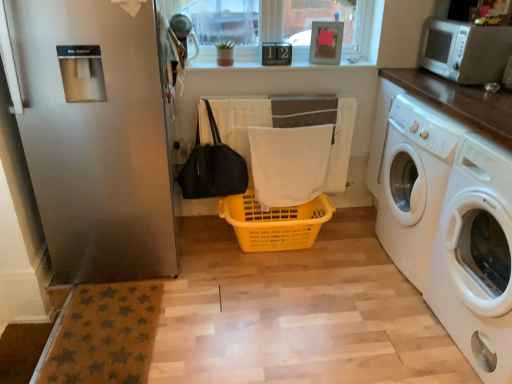
Question: From a real-world perspective, relative to white fabric bath towel at center, is white glossy washing machine at right, the 1th washing machine positioned from the front, vertically above or below?

Choices:
 (A) below
 (B) above

Answer: (B)

Question: Looking at their shapes, would you say white glossy washing machine at right, the 1th washing machine positioned from the front, is wider or thinner than white fabric bath towel at center?

Choices:
 (A) thin
 (B) wide

Answer: (B)

Question: Considering the real-world distances, which object is closest to the white glossy washing machine at right, which is the second washing machine in front-to-back order?

Choices:
 (A) black fabric bag at lower left
 (B) satin silver refrigerator at left
 (C) clear glass window at upper center
 (D) white fabric bath towel at center
 (E) yellow plastic basket at center

Answer: (D)

Question: Based on their relative distances, which object is farther from the white plastic microwave at upper right?

Choices:
 (A) white fabric bath towel at center
 (B) yellow plastic basket at center
 (C) black fabric bag at lower left
 (D) white glossy washing machine at right, which ranks as the first washing machine in back-to-front order
 (E) satin silver refrigerator at left

Answer: (E)